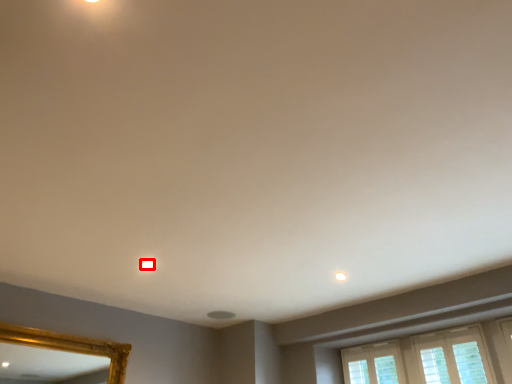
Question: Observing the image, what is the correct spatial positioning of lighting (annotated by the red box) in reference to light?

Choices:
 (A) left
 (B) right

Answer: (A)